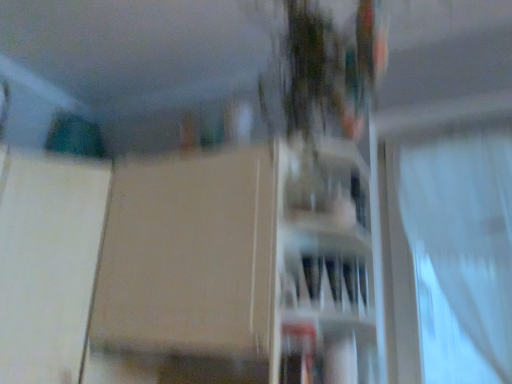
Looking at this image, what is the approximate height of white sheer curtain at right?

The height of white sheer curtain at right is 32.35 inches.

In order to face white matte screen door at left, should I rotate leftwards or rightwards?

You should rotate left by 24.613 degrees.

Describe the element at coordinates (48, 263) in the screenshot. I see `white matte screen door at left` at that location.

What do you see at coordinates (359, 199) in the screenshot?
I see `transparent glass window at upper right` at bounding box center [359, 199].

At what (x,y) coordinates should I click in order to perform the action: click on white sheer curtain at right. Please return your answer as a coordinate pair (x, y). Looking at the image, I should click on (449, 253).

From the image's perspective, is matte white vase at center over white matte screen door at left?

Yes, from the image's perspective, matte white vase at center is above white matte screen door at left.

Where is `shelf that appears above the white matte screen door at left (from a real-world perspective)`? This screenshot has width=512, height=384. shelf that appears above the white matte screen door at left (from a real-world perspective) is located at coordinates (330, 183).

Between point (322, 161) and point (88, 205), which one is positioned behind?

The point (88, 205) is farther.

Between matte white vase at center and white matte screen door at left, which one has smaller size?

With smaller size is matte white vase at center.

Consider the image. Considering the relative positions of white sheer curtain at right and white matte screen door at left in the image provided, is white sheer curtain at right to the right of white matte screen door at left from the viewer's perspective?

Indeed, white sheer curtain at right is positioned on the right side of white matte screen door at left.

From the picture: Considering the sizes of objects white sheer curtain at right and white matte screen door at left in the image provided, who is thinner, white sheer curtain at right or white matte screen door at left?

With smaller width is white sheer curtain at right.

Is white sheer curtain at right facing towards white matte screen door at left?

No, white sheer curtain at right is not facing towards white matte screen door at left.

From a real-world perspective, is white matte screen door at left located beneath transparent glass window at upper right?

A: Yes, from a real-world perspective, white matte screen door at left is beneath transparent glass window at upper right.

Does point (80, 320) lie behind point (361, 194)?

Yes, point (80, 320) is behind point (361, 194).

Is white matte screen door at left positioned with its back to transparent glass window at upper right?

That's not correct — white matte screen door at left is not looking away from transparent glass window at upper right.

Would you say white matte screen door at left is outside transparent glass window at upper right?

Yes, white matte screen door at left is outside of transparent glass window at upper right.

Do you think matte white vase at center is within white sheer curtain at right, or outside of it?

matte white vase at center exists outside the volume of white sheer curtain at right.

From a real-world perspective, is matte white vase at center above or below white sheer curtain at right?

Clearly, from a real-world perspective, matte white vase at center is above white sheer curtain at right.

Is matte white vase at center closer to camera compared to white sheer curtain at right?

Yes, it is in front of white sheer curtain at right.

Is point (287, 192) positioned in front of point (495, 374)?

That is True.

How far apart are white matte screen door at left and matte white vase at center?

30.51 inches.

What are the coordinates of `screen door lying on the left of matte white vase at center` in the screenshot? It's located at (48, 263).

From a real-world perspective, which is physically above, white matte screen door at left or matte white vase at center?

From a 3D spatial view, matte white vase at center is above.

Is white matte screen door at left further to camera compared to matte white vase at center?

No, white matte screen door at left is in front of matte white vase at center.

In the scene shown: Is white matte screen door at left further to camera compared to white sheer curtain at right?

No, it is not.

Is white matte screen door at left taller than white sheer curtain at right?

No, white matte screen door at left is not taller than white sheer curtain at right.

In terms of width, does white matte screen door at left look wider or thinner when compared to white sheer curtain at right?

Considering their sizes, white matte screen door at left looks broader than white sheer curtain at right.

Looking at this image, from a real-world perspective, is white matte screen door at left physically located above or below white sheer curtain at right?

Clearly, from a real-world perspective, white matte screen door at left is below white sheer curtain at right.

From a real-world perspective, which object rests below the other?

white sheer curtain at right.

Is transparent glass window at upper right at the back of white sheer curtain at right?

white sheer curtain at right does not have its back to transparent glass window at upper right.

Is point (399, 373) farther from viewer compared to point (359, 192)?

Yes.

Considering the relative sizes of white sheer curtain at right and transparent glass window at upper right in the image provided, is white sheer curtain at right taller than transparent glass window at upper right?

Indeed, white sheer curtain at right has a greater height compared to transparent glass window at upper right.

Identify the location of shelf above the white matte screen door at left (from the image's perspective). Image resolution: width=512 pixels, height=384 pixels. (330, 183).

Where is `screen door in front of the white sheer curtain at right`? The width and height of the screenshot is (512, 384). screen door in front of the white sheer curtain at right is located at coordinates (48, 263).

When comparing their distances from white matte screen door at left, does matte white vase at center or white sheer curtain at right seem further?

white sheer curtain at right is further to white matte screen door at left.

From the picture: Estimate the real-world distances between objects in this image. Which object is closer to transparent glass window at upper right, white matte screen door at left or white sheer curtain at right?

white sheer curtain at right.

Considering their positions, is matte white vase at center positioned further to white sheer curtain at right than white matte screen door at left?

white matte screen door at left is positioned further to the anchor white sheer curtain at right.

Looking at the image, which one is located closer to white matte screen door at left, transparent glass window at upper right or white sheer curtain at right?

Among the two, transparent glass window at upper right is located nearer to white matte screen door at left.

In the scene shown: Looking at the image, which one is located closer to transparent glass window at upper right, white matte screen door at left or matte white vase at center?

Among the two, matte white vase at center is located nearer to transparent glass window at upper right.

Estimate the real-world distances between objects in this image. Which object is closer to white sheer curtain at right, transparent glass window at upper right or white matte screen door at left?

transparent glass window at upper right is closer to white sheer curtain at right.

Based on their spatial positions, is white sheer curtain at right or transparent glass window at upper right closer to matte white vase at center?

The object closer to matte white vase at center is transparent glass window at upper right.

Estimate the real-world distances between objects in this image. Which object is further from matte white vase at center, transparent glass window at upper right or white sheer curtain at right?

white sheer curtain at right is positioned further to the anchor matte white vase at center.

In order to click on window located between white matte screen door at left and white sheer curtain at right in the left-right direction in this screenshot , I will do `click(359, 199)`.

The height and width of the screenshot is (384, 512). In order to click on shelf between white matte screen door at left and transparent glass window at upper right in the horizontal direction in this screenshot , I will do click(330, 183).

The image size is (512, 384). What are the coordinates of `window situated between matte white vase at center and white sheer curtain at right from left to right` in the screenshot? It's located at coord(359,199).

Identify the location of shelf situated between white matte screen door at left and white sheer curtain at right from left to right. (330, 183).